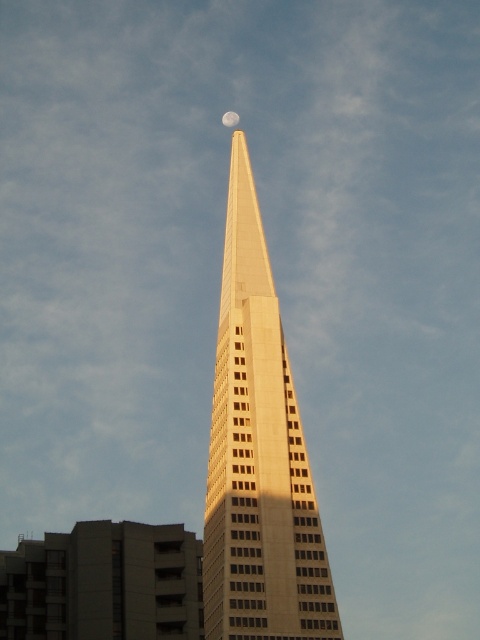
You are an astronaut floating in space and looking at the image. You want to know if the beige concrete skyscraper at center is positioned above or below the silvery reflective moon at upper center. Based on the scene, what can you conclude?

The beige concrete skyscraper at center is located below the silvery reflective moon at upper center, so it is positioned below the moon.

From the picture: You are an architect designing a new city layout. You need to ensure that the beige concrete skyscraper at center does not block the view of the silvery reflective moon at upper center from the observation deck. Based on their sizes, can you determine if the skyscraper will obscure the moon?

The beige concrete skyscraper at center is larger in size than the silvery reflective moon at upper center. Since the skyscraper is larger, it could potentially block the view of the moon if positioned directly between the observation deck and the moon.

You are standing in front of the skyscraper and notice two points marked on the building. The first point is at coordinates point (289, 472) and the second is at point (227, 122). Which of these points is physically closer to you?

Point (289, 472) is closer to the viewer than point (227, 122).